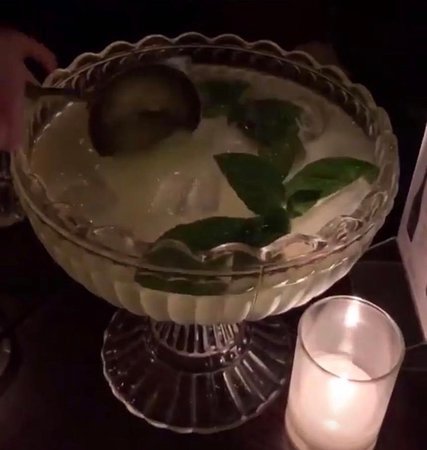
What are the coordinates of `candle` in the screenshot? It's located at (332, 419).